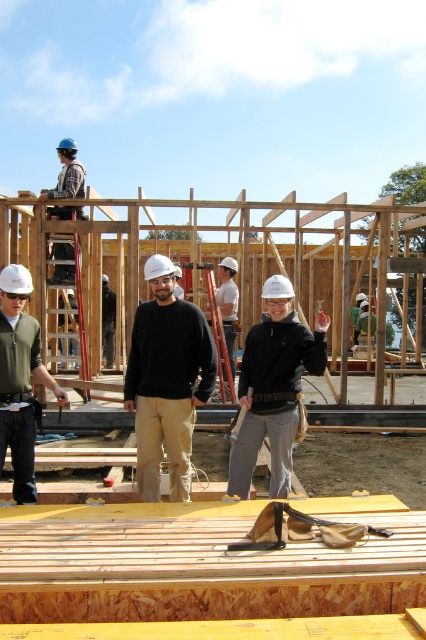
The image size is (426, 640). Describe the element at coordinates (166, 381) in the screenshot. I see `black matte sweater at center` at that location.

Is point (134, 381) less distant than point (275, 372)?

No, it is behind (275, 372).

Find the location of a particular element. This screenshot has width=426, height=640. black matte sweater at center is located at coordinates (166, 381).

Which of these two, black matte sweater at center or matte black helmet at upper left, stands taller?

Standing taller between the two is black matte sweater at center.

Can you confirm if black matte sweater at center is thinner than matte black helmet at upper left?

Incorrect, black matte sweater at center's width is not less than matte black helmet at upper left's.

Is point (149, 401) positioned after point (72, 272)?

No, (149, 401) is in front of (72, 272).

At what (x,y) coordinates should I click in order to perform the action: click on black matte sweater at center. Please return your answer as a coordinate pair (x, y). Looking at the image, I should click on (166, 381).

Between black matte sweater at center and white hard hat at center, which one has more height?

white hard hat at center

The width and height of the screenshot is (426, 640). I want to click on black matte sweater at center, so click(x=166, y=381).

Between point (146, 392) and point (224, 328), which one is positioned in front?

Point (146, 392)

Identify the location of black matte sweater at center. This screenshot has height=640, width=426. (166, 381).